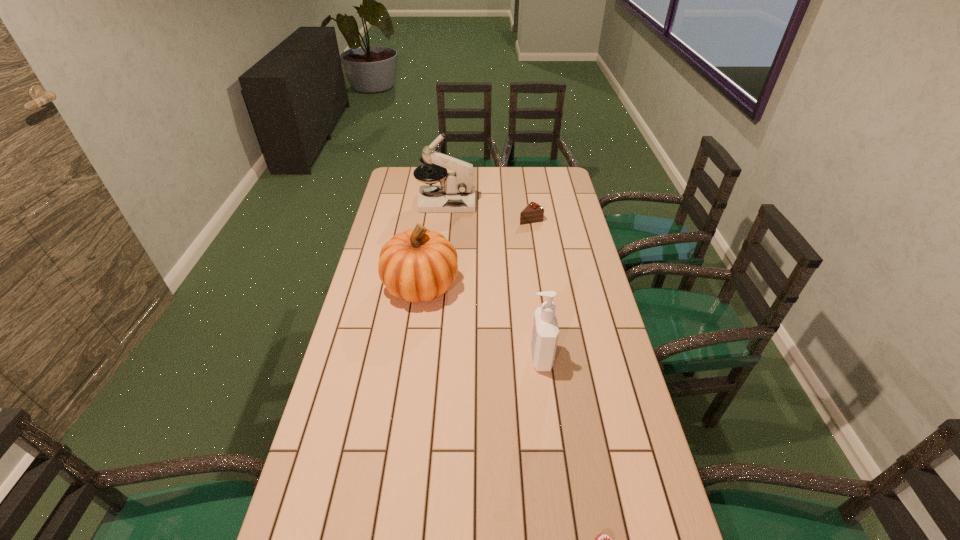
Locate an element on the screen. microscope is located at coordinates (456, 193).

Identify the location of the fourth farthest object. (545, 332).

Locate an element on the screen. This screenshot has width=960, height=540. pumpkin is located at coordinates (418, 265).

You are a GUI agent. You are given a task and a screenshot of the screen. Output one action in this format:
    pyautogui.click(x=<x>, y=<y>)
    Task: Click on the second shortest object
    
    Given the screenshot: What is the action you would take?
    pyautogui.click(x=533, y=212)

Image resolution: width=960 pixels, height=540 pixels. I want to click on the taller chocolate cake, so click(533, 212).

I want to click on free space located 0.090m at the eyepiece of the microscope, so click(x=495, y=202).

Image resolution: width=960 pixels, height=540 pixels. I want to click on vacant space located 0.390m on the front label of the cleansing agent, so click(x=401, y=357).

Identify the location of blank space located on the front label of the cleansing agent. (434, 357).

Locate an element on the screen. vacant space located on the front label of the cleansing agent is located at coordinates (467, 357).

Locate an element on the screen. This screenshot has height=540, width=960. free space located 0.070m on the right of the third nearest object is located at coordinates (478, 285).